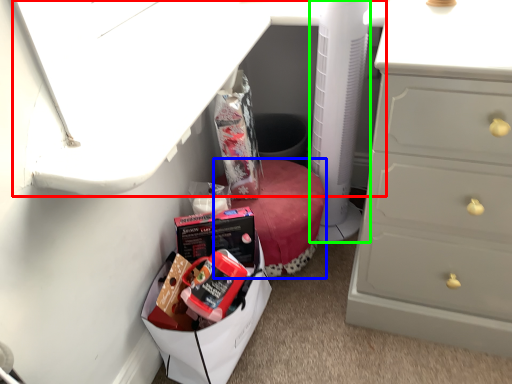
Question: Which is farther away from vanity (highlighted by a red box)? furniture (highlighted by a blue box) or appliance (highlighted by a green box)?

Choices:
 (A) furniture
 (B) appliance

Answer: (A)